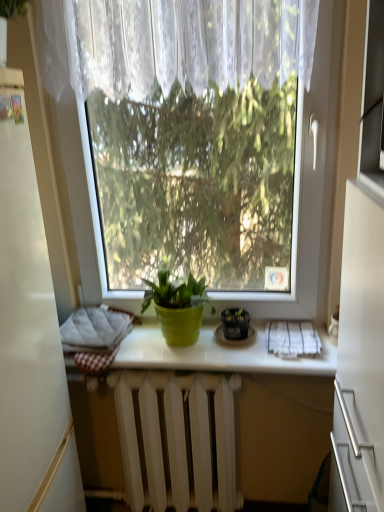
Locate an element on the screen. The image size is (384, 512). free point below white textured cloth at lower right (from a real-world perspective) is located at coordinates (289, 347).